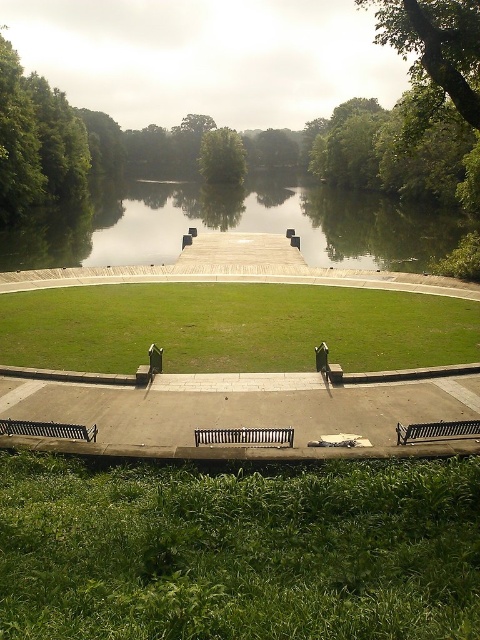
Question: Can you confirm if green grassy field at center is positioned to the left of green leafy tree at center?

Choices:
 (A) yes
 (B) no

Answer: (B)

Question: Estimate the real-world distances between objects in this image. Which object is farther from the green leafy tree at upper right?

Choices:
 (A) green reflective water at center
 (B) metallic silver bench at lower right
 (C) green grassy at lower center
 (D) green leafy tree at center

Answer: (D)

Question: Is green grassy at lower center to the right of green leafy tree at center from the viewer's perspective?

Choices:
 (A) no
 (B) yes

Answer: (B)

Question: Does metallic silver bench at center appear on the right side of black metal bench at lower left?

Choices:
 (A) no
 (B) yes

Answer: (B)

Question: Which point is farther to the camera?

Choices:
 (A) (288, 428)
 (B) (437, 96)
 (C) (405, 502)

Answer: (B)

Question: Which point is closer to the camera?

Choices:
 (A) green grassy at lower center
 (B) green grassy field at center
 (C) green leafy tree at center
 (D) metallic silver bench at center

Answer: (A)